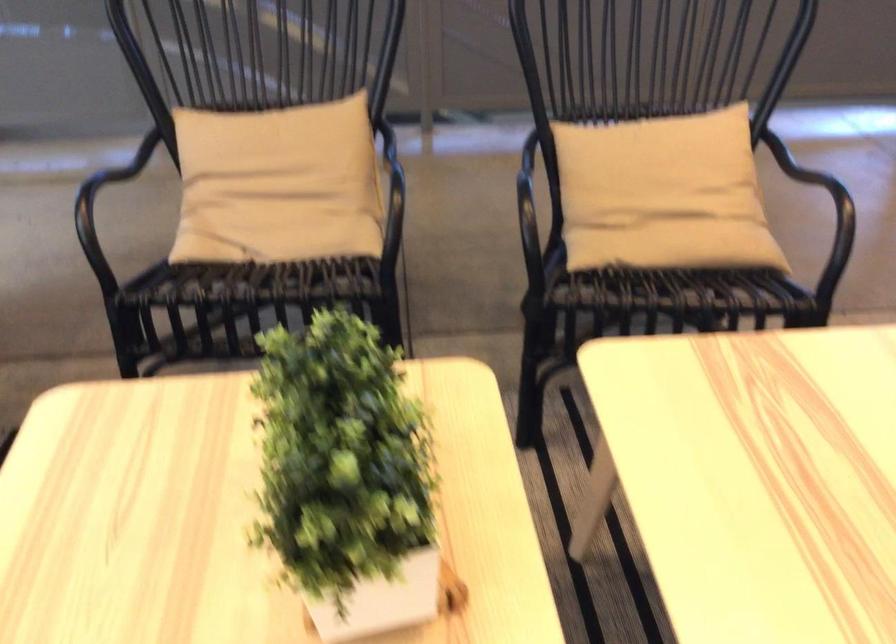
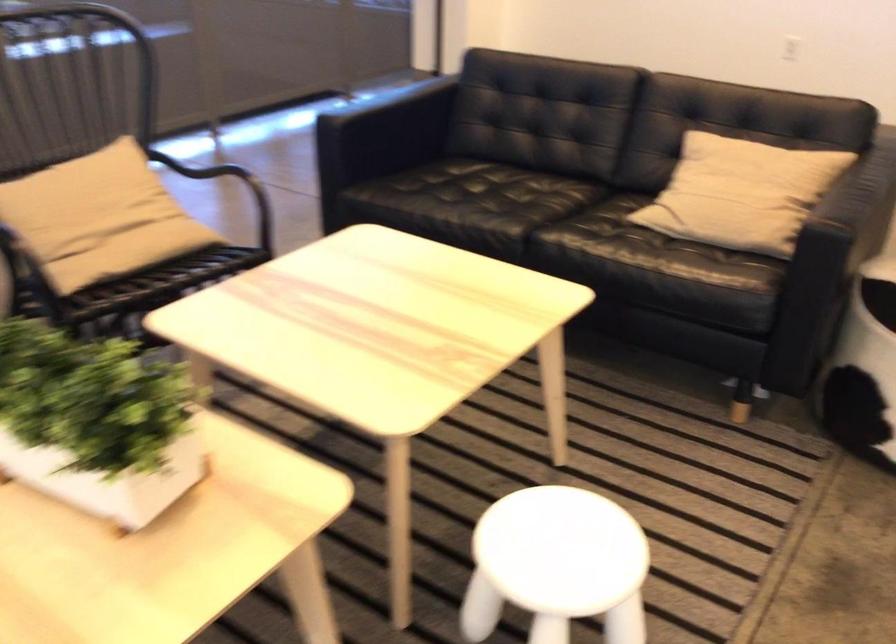
Find the pixel in the second image that matches (340,512) in the first image.

(96, 422)